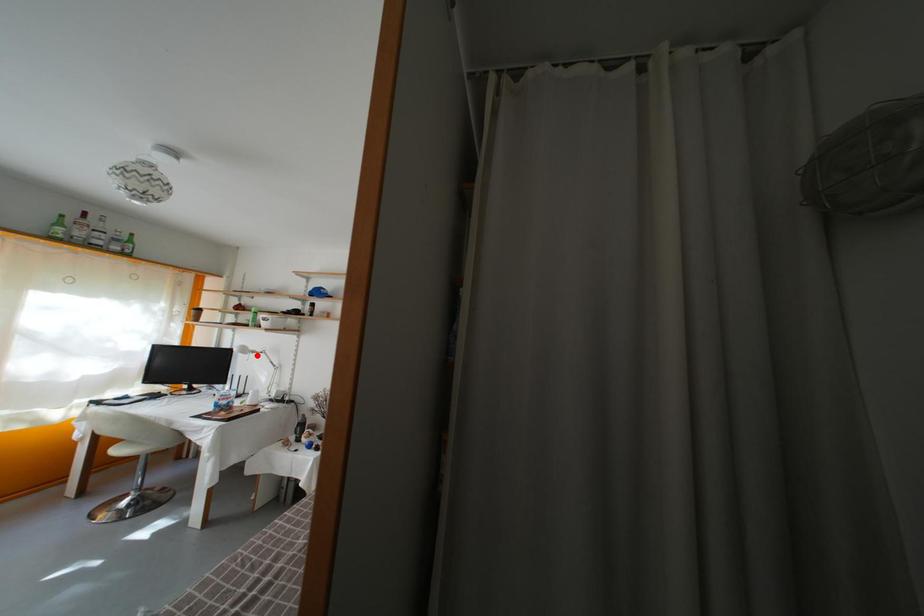
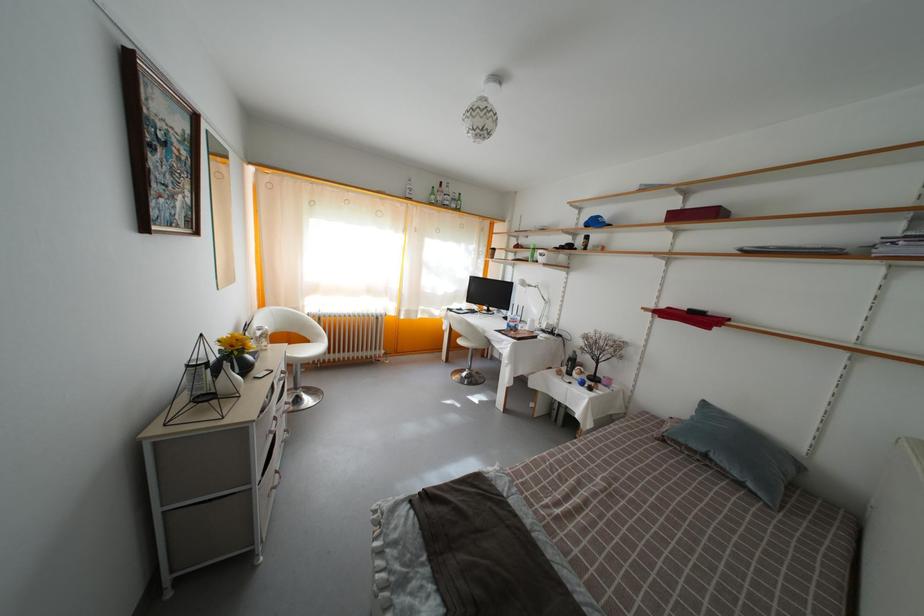
Question: I am providing you with two images of the same scene from different viewpoints. A red point is shown in image1. For the corresponding object point in image2, is it positioned nearer or farther from the camera?

Choices:
 (A) Nearer
 (B) Farther

Answer: (A)